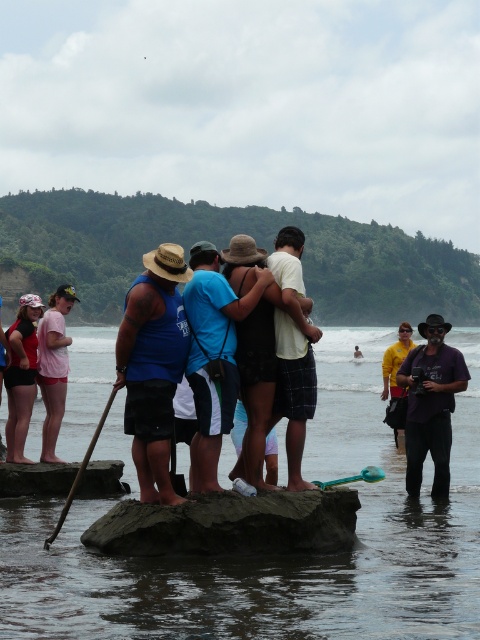
Can you confirm if pink fabric at left is wider than teal plastic paddle at center?

Correct, the width of pink fabric at left exceeds that of teal plastic paddle at center.

Which is behind, point (67, 340) or point (346, 481)?

The point (67, 340) is more distant.

The height and width of the screenshot is (640, 480). I want to click on pink fabric at left, so click(54, 368).

Does blue fabric shirt at center have a lesser height compared to pink fabric at left?

Incorrect, blue fabric shirt at center's height does not fall short of pink fabric at left's.

Can you confirm if blue fabric shirt at center is positioned to the left of pink fabric at left?

In fact, blue fabric shirt at center is to the right of pink fabric at left.

The height and width of the screenshot is (640, 480). Find the location of `blue fabric shirt at center`. blue fabric shirt at center is located at coordinates (153, 365).

The image size is (480, 640). What do you see at coordinates (153, 365) in the screenshot?
I see `blue fabric shirt at center` at bounding box center [153, 365].

Who is lower down, blue fabric shirt at center or matte black shirt at center?

blue fabric shirt at center is lower down.

Measure the distance between blue fabric shirt at center and camera.

blue fabric shirt at center is 37.24 meters from camera.

The width and height of the screenshot is (480, 640). I want to click on blue fabric shirt at center, so point(153,365).